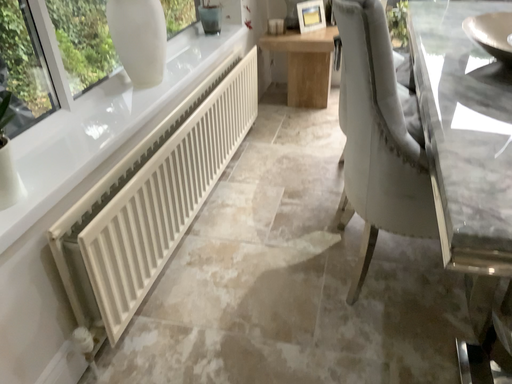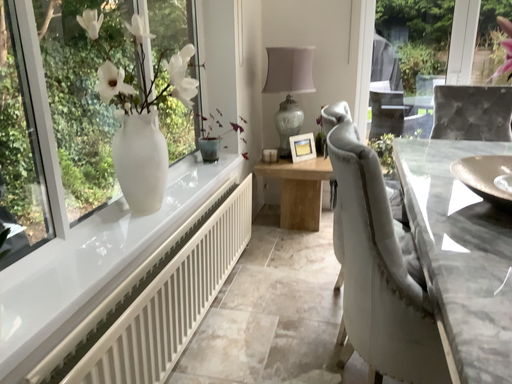
Question: Which way did the camera rotate in the video?

Choices:
 (A) rotated upward
 (B) rotated downward

Answer: (A)